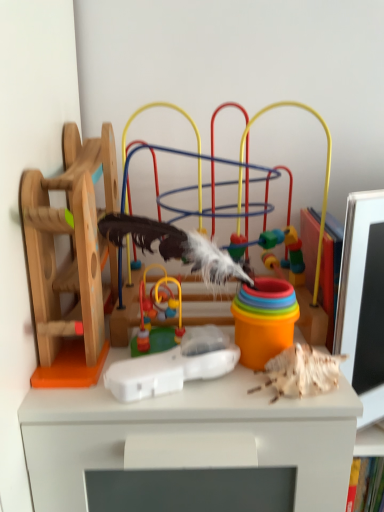
Question: From the image's perspective, is multicolored plastic toy at center, the 1th toy positioned from the right, above or below smooth plastic toy at center, placed as the 3th toy when sorted from right to left?

Choices:
 (A) above
 (B) below

Answer: (A)

Question: Relative to smooth plastic toy at center, placed as the 3th toy when sorted from right to left, is multicolored plastic toy at center, the 1th toy positioned from the right, in front or behind?

Choices:
 (A) front
 (B) behind

Answer: (A)

Question: Which is nearer to the white plastic remote at center, the 3th toy viewed from the left?

Choices:
 (A) multicolored plastic toy at center, the 1th toy positioned from the right
 (B) wooden toy at left, marked as the 1th toy in a left-to-right arrangement
 (C) smooth plastic toy at center, placed as the 3th toy when sorted from right to left

Answer: (C)

Question: Which object is positioned farthest from the wooden toy at left, marked as the 1th toy in a left-to-right arrangement?

Choices:
 (A) white plastic remote at center, arranged as the second toy when viewed from the right
 (B) smooth plastic toy at center, placed as the 3th toy when sorted from right to left
 (C) multicolored plastic toy at center, which appears as the fourth toy when viewed from the left

Answer: (A)